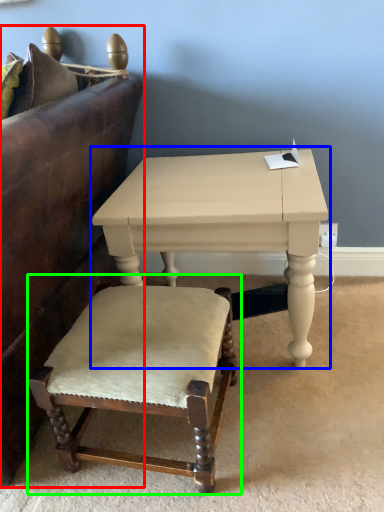
Question: Which object is positioned farthest from studio couch (highlighted by a red box)? Select from table (highlighted by a blue box) and chair (highlighted by a green box).

Choices:
 (A) table
 (B) chair

Answer: (B)